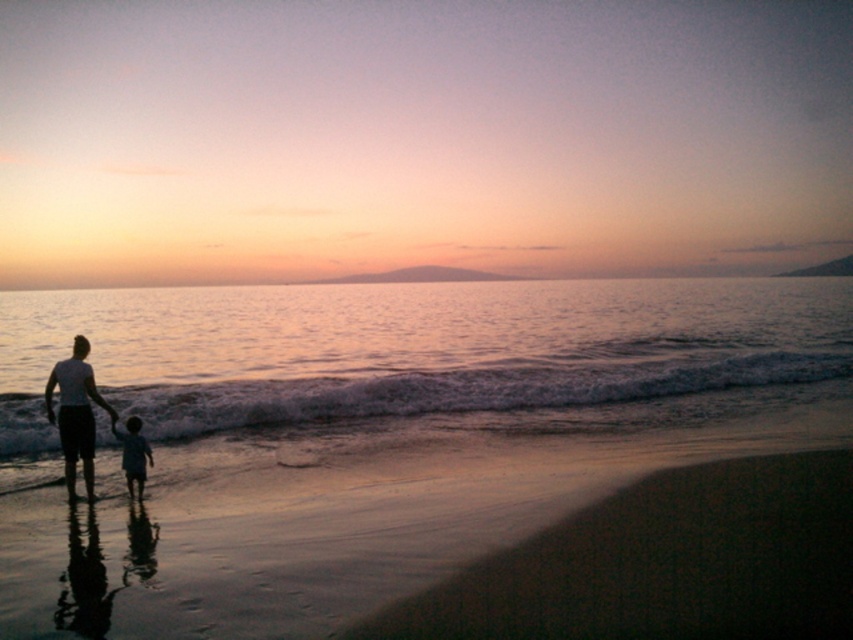
Which is below, sandy beach at lower left or smooth skin child at lower left?

sandy beach at lower left is below.

Is point (305, 579) positioned after point (126, 483)?

No, (305, 579) is closer to viewer.

Measure the distance between sandy beach at lower left and camera.

The distance of sandy beach at lower left from camera is 18.60 feet.

The image size is (853, 640). In order to click on sandy beach at lower left in this screenshot , I will do `click(328, 531)`.

Is shiny silver water at center positioned at the back of smooth skin child at lower left?

That is True.

Is shiny silver water at center above smooth skin child at lower left?

Yes, shiny silver water at center is above smooth skin child at lower left.

Does point (666, 364) lie in front of point (113, 426)?

No, (666, 364) is further to viewer.

The height and width of the screenshot is (640, 853). What are the coordinates of `shiny silver water at center` in the screenshot? It's located at (416, 362).

Between sandy beach at lower left and white matte shirt at left, which one appears on the left side from the viewer's perspective?

Positioned to the left is white matte shirt at left.

Is sandy beach at lower left positioned behind white matte shirt at left?

That is False.

Is point (622, 449) farther from viewer compared to point (78, 417)?

Yes, it is behind point (78, 417).

Locate an element on the screen. Image resolution: width=853 pixels, height=640 pixels. sandy beach at lower left is located at coordinates (328, 531).